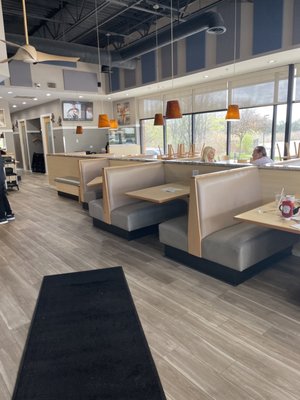
Where is `restaurant`? restaurant is located at coordinates (290, 147), (212, 143), (152, 204), (254, 210), (86, 179), (35, 195).